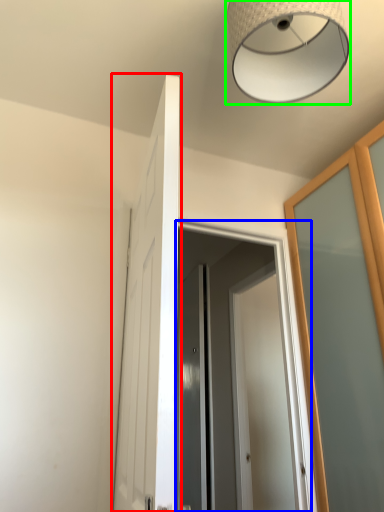
Question: Estimate the real-world distances between objects in this image. Which object is closer to door (highlighted by a red box), screen door (highlighted by a blue box) or lamp (highlighted by a green box)?

Choices:
 (A) screen door
 (B) lamp

Answer: (B)